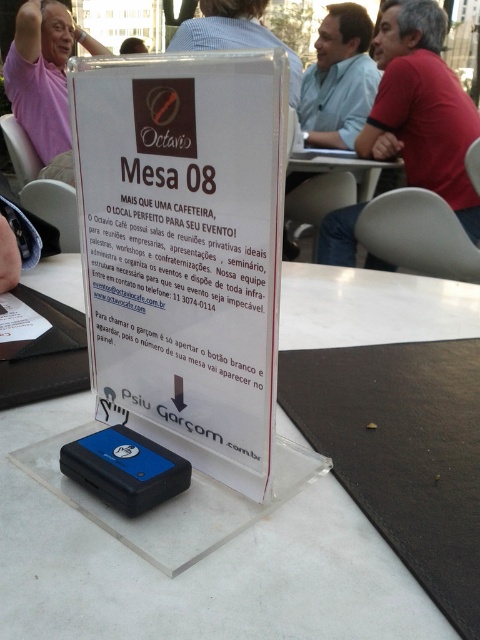
You are a customer at Octavio Cafe and you want to place your coffee cup between the light blue shirt at upper center and the pink fabric shirt at upper left. How much space do you have to work with?

The light blue shirt at upper center and the pink fabric shirt at upper left are 3.50 feet apart from each other, so you have 3.50 feet of space to place your coffee cup between them.

You are a customer at Octavio Cafe and want to read the transparent plastic sign at center. However, you are currently standing near the light blue shirt at upper center. Which direction should you move to reach the sign?

The transparent plastic sign at center is to the left of the light blue shirt at upper center, so you should move to your left to reach it.